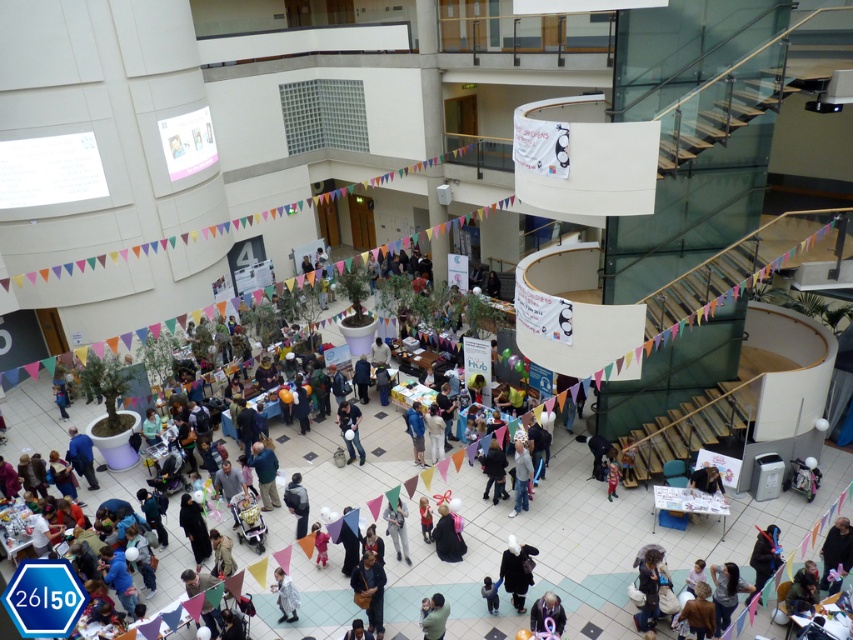
Based on the photo, you are standing at the entrance of the atrium and notice both the dark gray jacket at center and the green fabric person at lower center. Which object is closer to you?

The dark gray jacket at center is closer to you because it is further to the viewer than the green fabric person at lower center.

You are at the event and see the dark gray jacket at center and the green fabric person at lower center. Which object is covering the other?

The dark gray jacket at center is positioned over the green fabric person at lower center, so it is covering it.